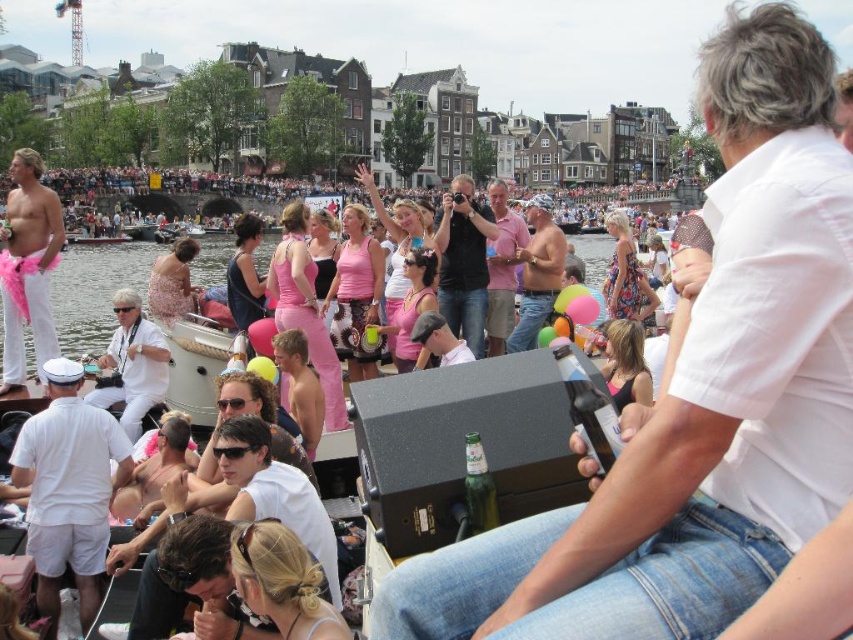
You are organizing a costume party and need to decide which item takes up more space. You have a pink feather boa at left and a white matte shirt at center. Based on the scene, which item is wider?

The pink feather boa at left is wider than the white matte shirt at center because its width surpasses the shirt.

You are standing on the dock and see the point marked at coordinates (132, 364). What object is located at that point?

The point at coordinates (132, 364) marks the white matte shirt at center.